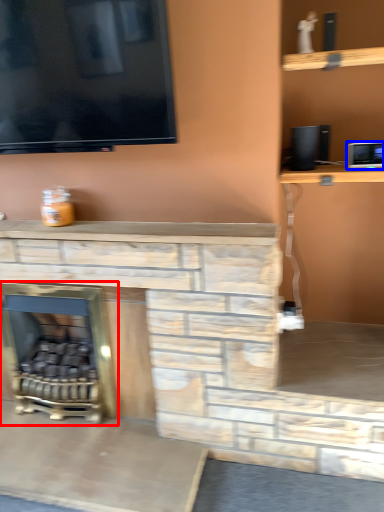
Question: Which object appears closest to the camera in this image, fireplace (highlighted by a red box) or appliance (highlighted by a blue box)?

Choices:
 (A) fireplace
 (B) appliance

Answer: (B)